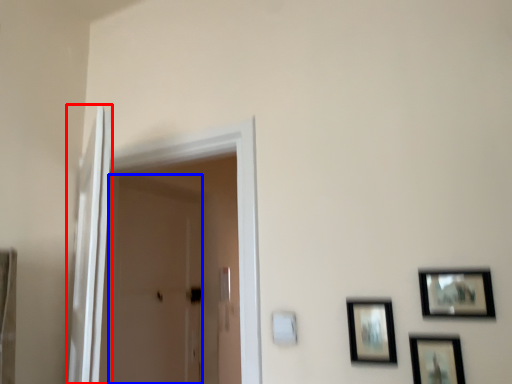
Question: Among these objects, which one is farthest to the camera, screen door (highlighted by a red box) or screen door (highlighted by a blue box)?

Choices:
 (A) screen door
 (B) screen door

Answer: (B)